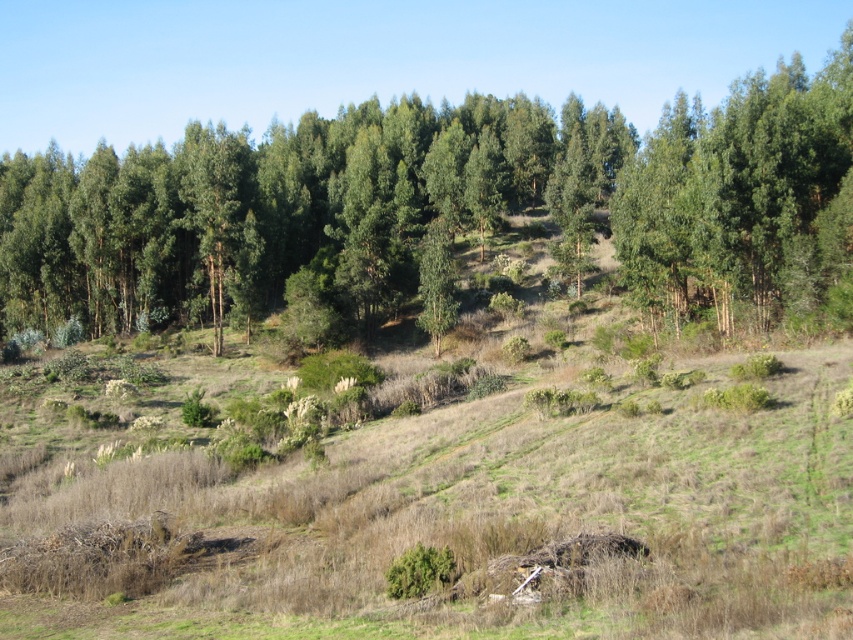
You are an environmental scientist studying the forest structure. You observe the green leafy trees at center and the green leafy tree at upper right. Which of these two trees is taller?

The green leafy trees at center is taller than the green leafy tree at upper right according to the description.

You are standing at the origin point in the image. Which direction should you walk to reach the green leafy trees at center?

The green leafy trees at center are located at point (432, 205), so you should walk towards the center of the image to reach them.